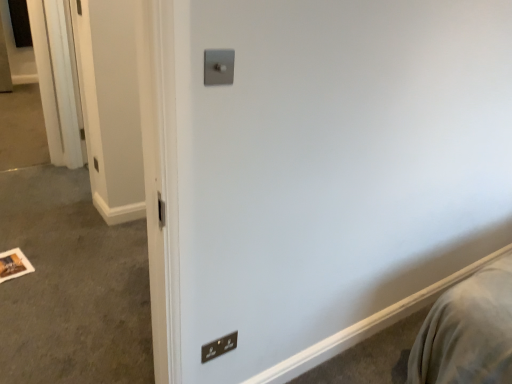
Question: Do you think satin silver switch at upper center, marked as the first light switch in a top-to-bottom arrangement, is within black plastic light switch at lower center, marked as the first light switch in a back-to-front arrangement, or outside of it?

Choices:
 (A) inside
 (B) outside

Answer: (B)

Question: From the image's perspective, is satin silver switch at upper center, marked as the first light switch in a top-to-bottom arrangement, above or below black plastic light switch at lower center, the 2th light switch in the front-to-back sequence?

Choices:
 (A) above
 (B) below

Answer: (A)

Question: Looking at the image, does satin silver switch at upper center, which ranks as the second light switch in bottom-to-top order, seem bigger or smaller compared to black plastic light switch at lower center, marked as the first light switch in a back-to-front arrangement?

Choices:
 (A) big
 (B) small

Answer: (A)

Question: From the image's perspective, is black plastic light switch at lower center, placed as the 2th light switch when sorted from top to bottom, positioned above or below satin silver switch at upper center, the first light switch positioned from the front?

Choices:
 (A) below
 (B) above

Answer: (A)

Question: Does point (233, 340) appear closer or farther from the camera than point (210, 84)?

Choices:
 (A) farther
 (B) closer

Answer: (A)

Question: From a real-world perspective, is black plastic light switch at lower center, marked as the first light switch in a back-to-front arrangement, positioned above or below satin silver switch at upper center, arranged as the 2th light switch when viewed from the back?

Choices:
 (A) above
 (B) below

Answer: (B)

Question: Considering the positions of black plastic light switch at lower center, the 2th light switch in the front-to-back sequence, and satin silver switch at upper center, the first light switch positioned from the front, in the image, is black plastic light switch at lower center, the 2th light switch in the front-to-back sequence, bigger or smaller than satin silver switch at upper center, the first light switch positioned from the front,?

Choices:
 (A) small
 (B) big

Answer: (A)